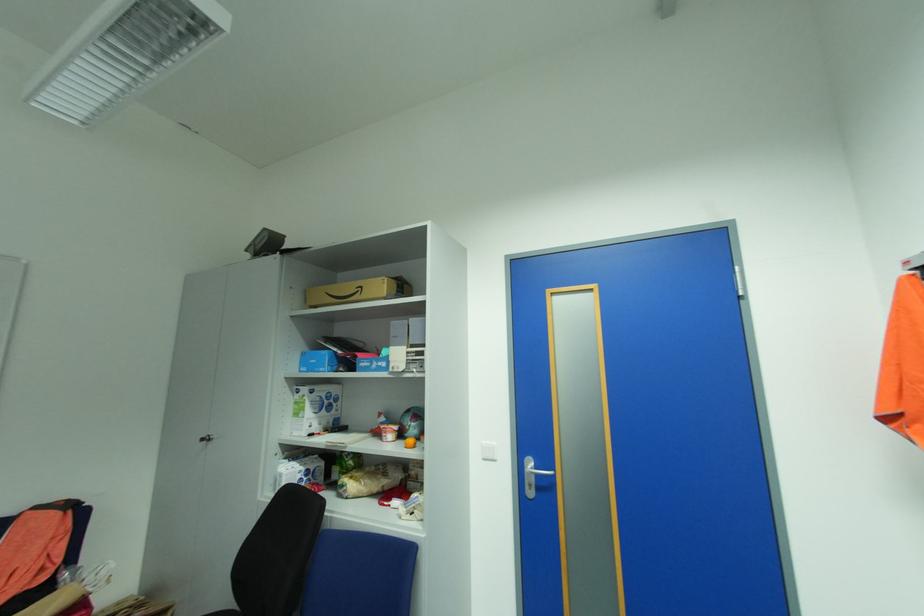
Describe the element at coordinates (537, 471) in the screenshot. Image resolution: width=924 pixels, height=616 pixels. I see `the silver door handle` at that location.